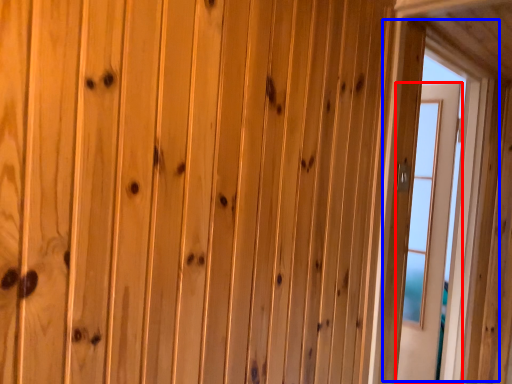
Question: Which object appears farthest to the camera in this image, door (highlighted by a red box) or window (highlighted by a blue box)?

Choices:
 (A) door
 (B) window

Answer: (A)